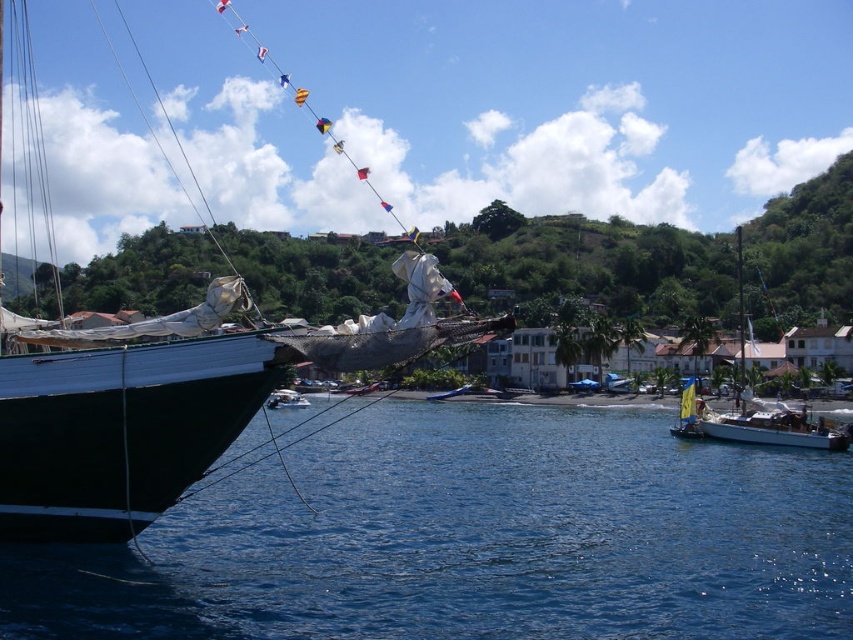
Question: Which point is closer to the camera?

Choices:
 (A) white matte sailboat at center
 (B) yellow fabric sailboat at right

Answer: (A)

Question: From the image, what is the correct spatial relationship of blue liquid water at lower left in relation to white glossy sailboat at lower right?

Choices:
 (A) left
 (B) right

Answer: (A)

Question: Among these objects, which one is farthest from the camera?

Choices:
 (A) shiny black sailboat at left
 (B) yellow fabric sailboat at right
 (C) white glossy sailboat at lower right

Answer: (B)

Question: Does white matte sailboat at right have a lesser width compared to yellow fabric sailboat at right?

Choices:
 (A) yes
 (B) no

Answer: (B)

Question: Is white glossy sailboat at lower right thinner than white matte sailboat at center?

Choices:
 (A) yes
 (B) no

Answer: (A)

Question: Which object appears closest to the camera in this image?

Choices:
 (A) white matte sailboat at right
 (B) blue liquid water at lower left

Answer: (B)